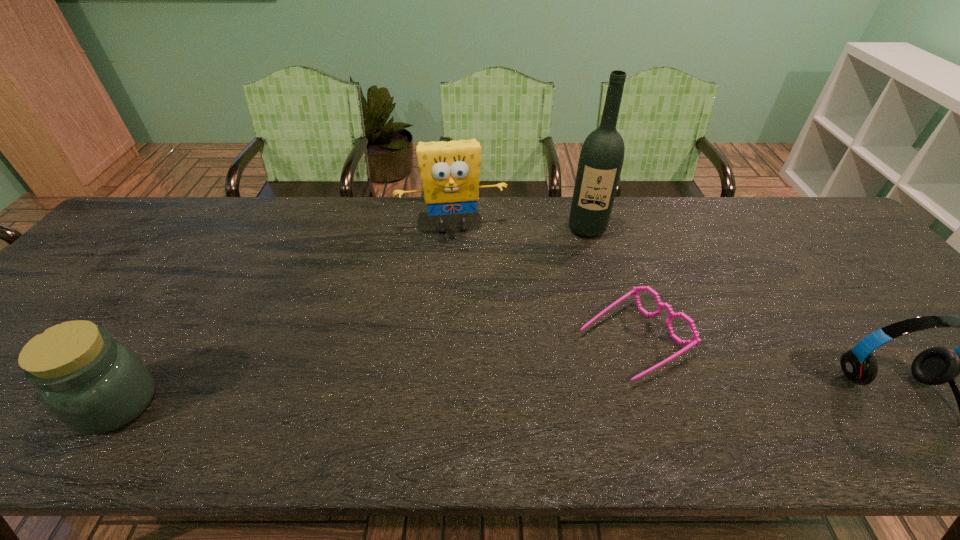
Image resolution: width=960 pixels, height=540 pixels. What are the coordinates of `free spot on the desktop that is between the leftmost object and the rightmost object and is positioned on the labeled side of the tallest object` in the screenshot? It's located at (578, 400).

Find the location of a particular element. The image size is (960, 540). free space on the desktop that is between the leftmost object and the headset and is positioned on the arms of the shortest object is located at coordinates point(532,400).

Locate an element on the screen. This screenshot has height=540, width=960. vacant space on the desktop that is between the jar and the headset and is positioned on the face of the second object from left to right is located at coordinates (476, 401).